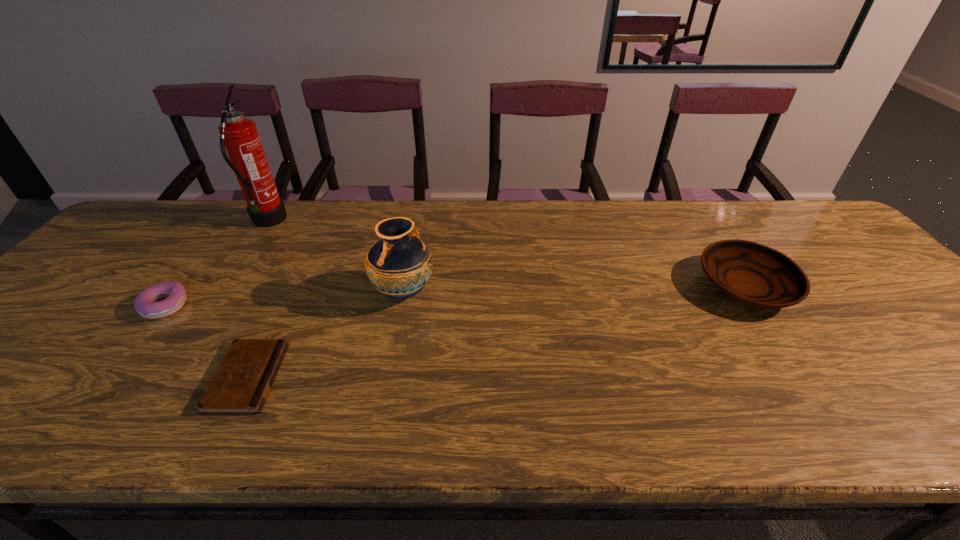
Identify the location of free spot between the second object from right to left and the nearest object. (325, 335).

Identify the location of free spot between the pastry and the third shortest object. This screenshot has height=540, width=960. (455, 295).

You are a GUI agent. You are given a task and a screenshot of the screen. Output one action in this format:
    pyautogui.click(x=<x>, y=<y>)
    Task: Click on the object that stands as the closest to the pastry
    This screenshot has height=540, width=960.
    Given the screenshot: What is the action you would take?
    pyautogui.click(x=241, y=384)

Locate which object ranks fourth in proximity to the shortest object. Please provide its 2D coordinates. Your answer should be formatted as a tuple, i.e. [(x, y)], where the tuple contains the x and y coordinates of a point satisfying the conditions above.

[(754, 274)]

Locate an element on the screen. vacant space that satisfies the following two spatial constraints: 1. on the back side of the pastry; 2. on the right side of the plate is located at coordinates (180, 286).

Where is `blank space that satisfies the following two spatial constraints: 1. on the front-facing side of the farthest object; 2. on the back side of the second tallest object`? This screenshot has width=960, height=540. blank space that satisfies the following two spatial constraints: 1. on the front-facing side of the farthest object; 2. on the back side of the second tallest object is located at coordinates (222, 293).

The height and width of the screenshot is (540, 960). Identify the location of free space that satisfies the following two spatial constraints: 1. on the front-facing side of the tallest object; 2. on the left side of the third tallest object. (227, 286).

Find the location of a particular element. vacant point that satisfies the following two spatial constraints: 1. on the front-facing side of the fire extinguisher; 2. on the back side of the third shortest object is located at coordinates (227, 286).

The width and height of the screenshot is (960, 540). I want to click on vacant space that satisfies the following two spatial constraints: 1. on the back side of the second tallest object; 2. on the front-facing side of the farthest object, so pos(417,222).

I want to click on vacant area that satisfies the following two spatial constraints: 1. on the front-facing side of the fire extinguisher; 2. on the right side of the fourth shortest object, so click(222, 293).